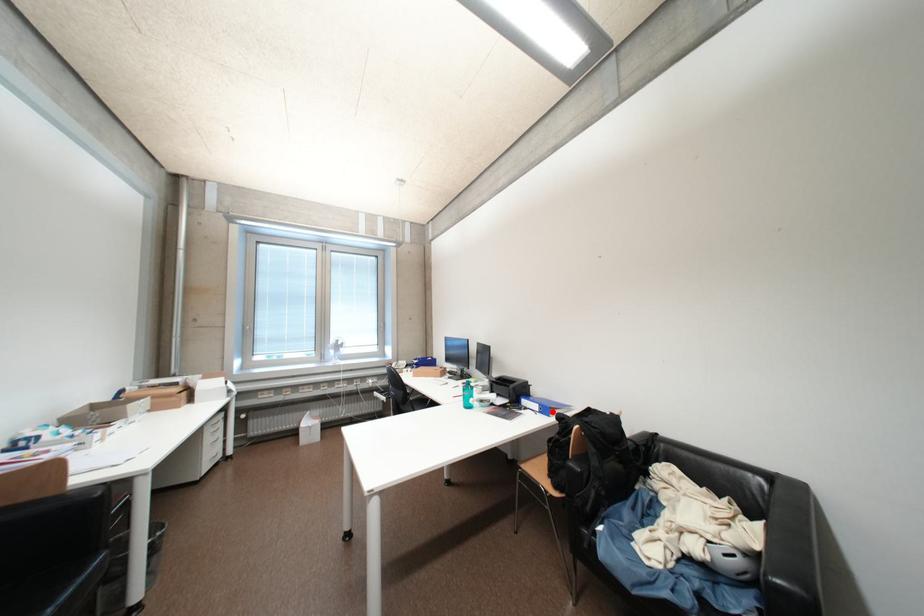
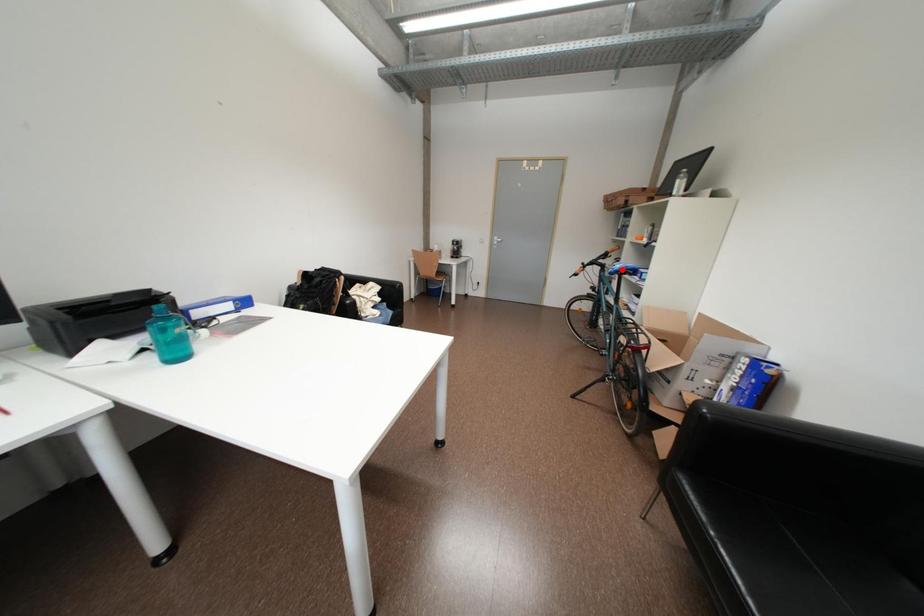
I am providing you with two images of the same scene from different viewpoints. A red point is marked on the first image and another point is marked on the second image. Does the point marked in image1 correspond to the same location as the one in image2?

No